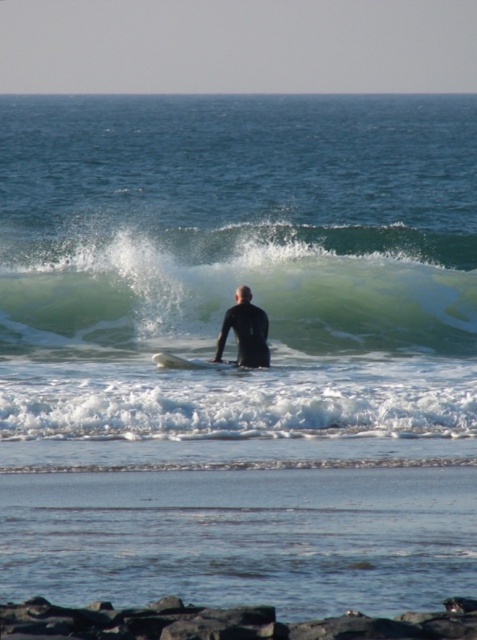
You are a lifeguard on duty and you see the green rubber wave at center and the black matte wetsuit at center in the water. Which object is taller?

The green rubber wave at center is much taller than the black matte wetsuit at center.

You are a surfer trying to catch a wave. You see a green rubber wave at center and a black rubber surfboard at center. Which object is positioned higher in the scene?

The green rubber wave at center is located above the black rubber surfboard at center, so the green rubber wave at center is positioned higher in the scene.